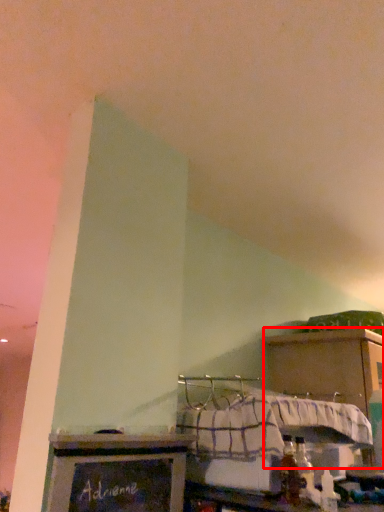
Question: From the image's perspective, where is cabinetry (annotated by the red box) located relative to furniture?

Choices:
 (A) above
 (B) below

Answer: (B)